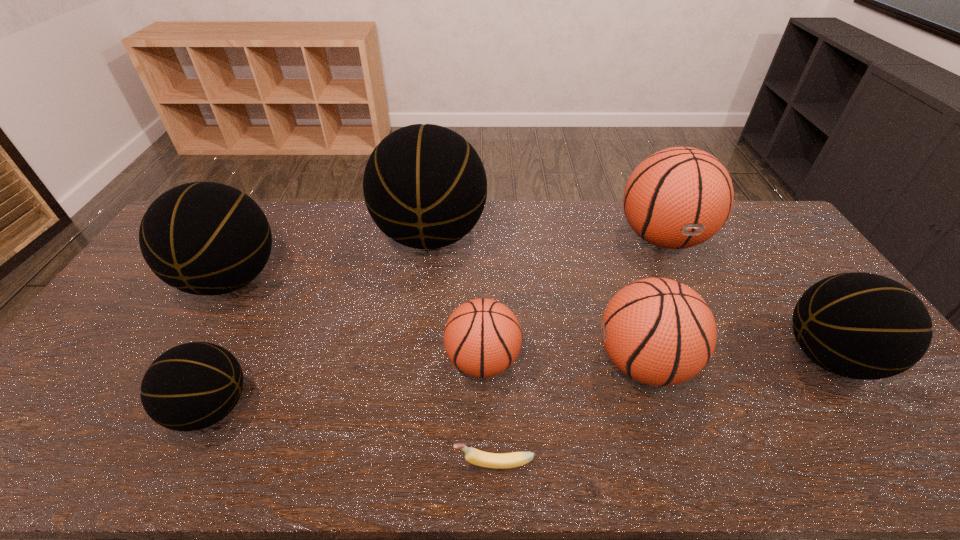
The height and width of the screenshot is (540, 960). I want to click on orange basketball that is the closest to the smallest orange basketball, so click(x=657, y=331).

At what (x,y) coordinates should I click in order to perform the action: click on free location that satisfies the following two spatial constraints: 1. on the side where the inflation valve is located; 2. at the stem of the banana. Please return your answer as a coordinate pair (x, y). The image size is (960, 540). Looking at the image, I should click on (768, 463).

What are the coordinates of `vacant space that satisfies the following two spatial constraints: 1. on the front side of the rightmost basketball; 2. on the side where the inflation valve is located` in the screenshot? It's located at (833, 363).

In order to click on blank area in the image that satisfies the following two spatial constraints: 1. on the side where the inflation valve is located; 2. at the stem of the yellow banana in this screenshot , I will do `click(768, 463)`.

The width and height of the screenshot is (960, 540). I want to click on vacant space that satisfies the following two spatial constraints: 1. on the side where the inflation valve is located; 2. at the stem of the shortest object, so click(768, 463).